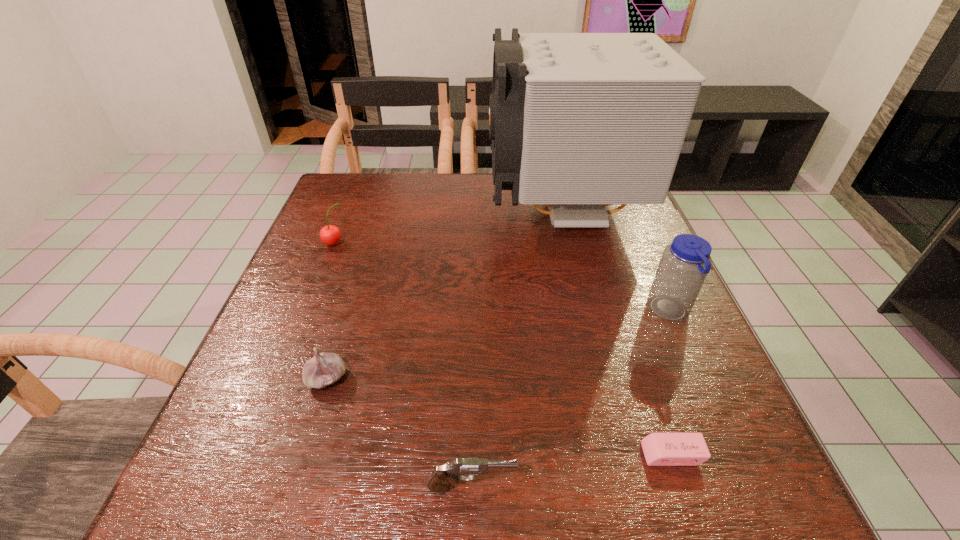
At what (x,y) coordinates should I click in order to perform the action: click on eraser at the near edge. Please return your answer as a coordinate pair (x, y). The width and height of the screenshot is (960, 540). Looking at the image, I should click on (660, 449).

Image resolution: width=960 pixels, height=540 pixels. I want to click on cherry present at the left edge, so click(330, 234).

You are a GUI agent. You are given a task and a screenshot of the screen. Output one action in this format:
    pyautogui.click(x=<x>, y=<y>)
    Task: Click on the garlic that is at the left edge
    Image resolution: width=960 pixels, height=540 pixels.
    Given the screenshot: What is the action you would take?
    pyautogui.click(x=324, y=369)

The image size is (960, 540). I want to click on fan that is at the right edge, so click(578, 121).

You are a GUI agent. You are given a task and a screenshot of the screen. Output one action in this format:
    pyautogui.click(x=<x>, y=<y>)
    Task: Click on the water bottle located at the right edge
    The height and width of the screenshot is (540, 960).
    Given the screenshot: What is the action you would take?
    pyautogui.click(x=684, y=265)

The width and height of the screenshot is (960, 540). In order to click on eraser positioned at the right edge in this screenshot , I will do `click(660, 449)`.

The image size is (960, 540). I want to click on object positioned at the far right corner, so click(x=578, y=121).

Locate an element on the screen. The image size is (960, 540). object that is at the near right corner is located at coordinates (660, 449).

Where is `free spot at the far edge of the desktop`? free spot at the far edge of the desktop is located at coordinates (507, 199).

In the image, there is a desktop. Find the location of `free space at the near edge`. free space at the near edge is located at coordinates (620, 497).